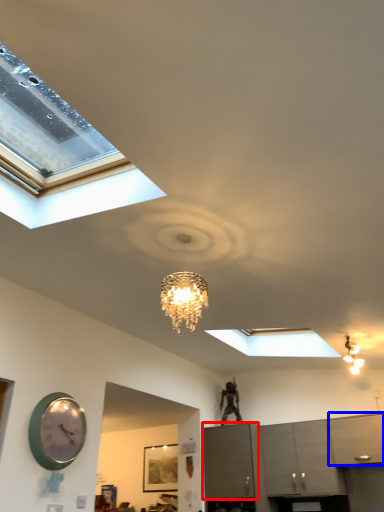
Question: Among these objects, which one is farthest to the camera, cabinetry (highlighted by a red box) or cabinetry (highlighted by a blue box)?

Choices:
 (A) cabinetry
 (B) cabinetry

Answer: (A)